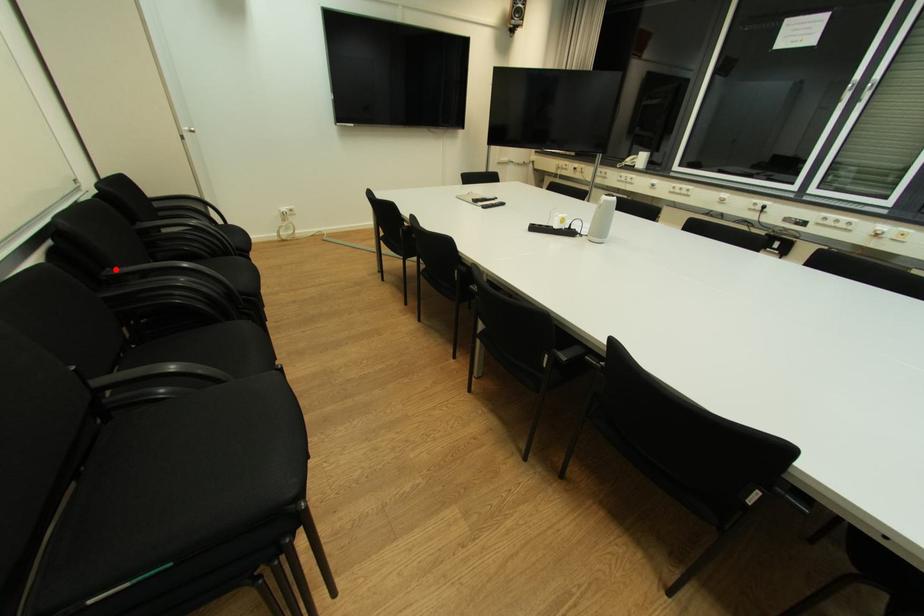
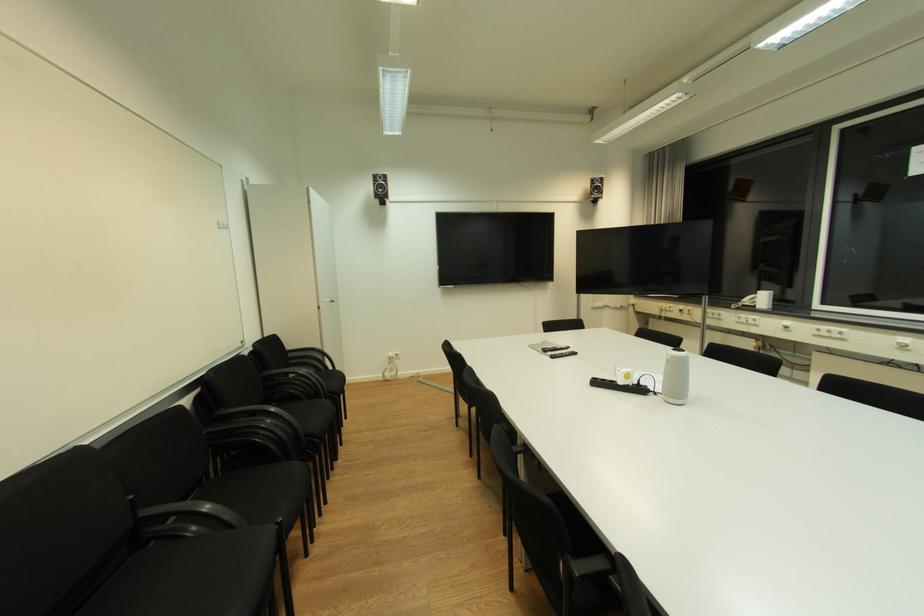
Find the pixel in the second image that matches the highlighted location in the first image.

(227, 410)